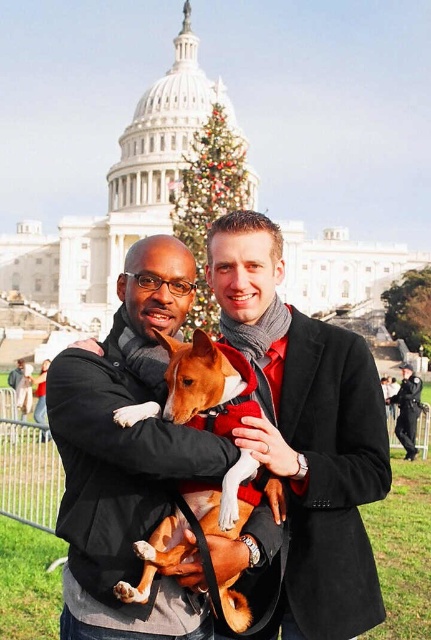
Describe the element at coordinates (128, 458) in the screenshot. I see `matte black jacket at center` at that location.

Find the location of `matte black jacket at center`. matte black jacket at center is located at coordinates (128, 458).

Is matte black jacket at center to the left of brown furry dog at center from the viewer's perspective?

Yes, matte black jacket at center is to the left of brown furry dog at center.

Does point (65, 468) lie behind point (205, 525)?

Yes, it is behind point (205, 525).

This screenshot has width=431, height=640. Find the location of `matte black jacket at center`. matte black jacket at center is located at coordinates (128, 458).

Which is more to the left, matte black jacket at center or dark blue uniform at center?

From the viewer's perspective, matte black jacket at center appears more on the left side.

Is point (68, 493) closer to camera compared to point (421, 410)?

Yes, point (68, 493) is in front of point (421, 410).

Who is more forward, (x=253, y=538) or (x=409, y=410)?

Positioned in front is point (x=253, y=538).

The width and height of the screenshot is (431, 640). Identify the location of matte black jacket at center. (128, 458).